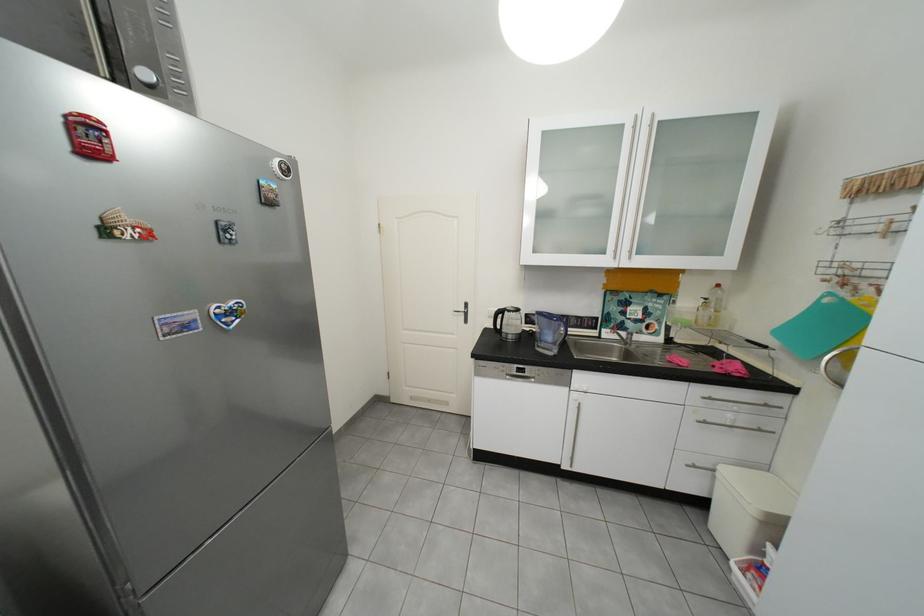
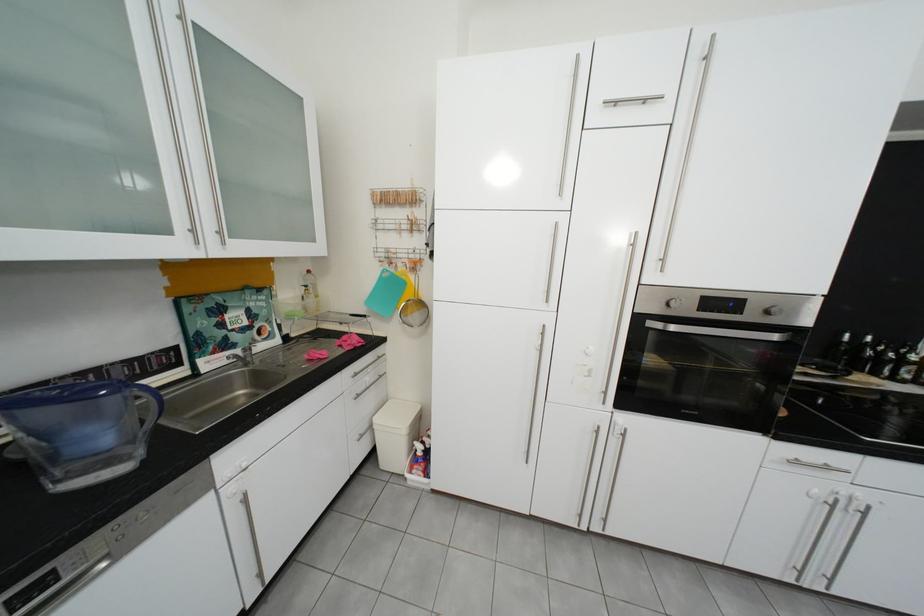
Where in the second image is the point corresponding to the point at 730,476 from the first image?

(386, 428)